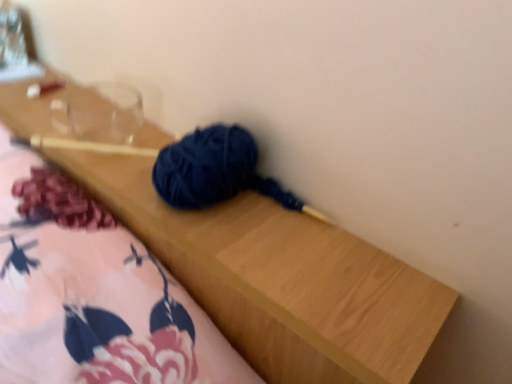
Question: Do you think transparent glass jar at upper left is within transparent glass at upper left, or outside of it?

Choices:
 (A) outside
 (B) inside

Answer: (A)

Question: In terms of width, does transparent glass jar at upper left look wider or thinner when compared to transparent glass at upper left?

Choices:
 (A) wide
 (B) thin

Answer: (A)

Question: Estimate the real-world distances between objects in this image. Which object is closer to the transparent glass at upper left?

Choices:
 (A) transparent glass jar at upper left
 (B) fluffy pink blanket at lower left

Answer: (A)

Question: Considering the real-world distances, which object is farthest from the fluffy pink blanket at lower left?

Choices:
 (A) transparent glass at upper left
 (B) transparent glass jar at upper left

Answer: (B)